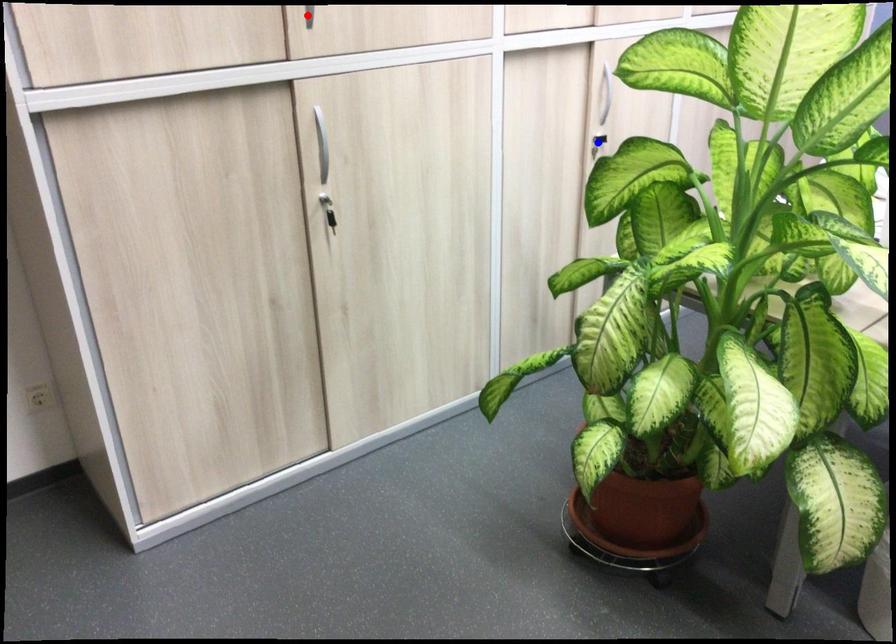
Question: In the image, two points are highlighted. Which point is nearer to the camera? Reply with the corresponding letter.

Choices:
 (A) blue point
 (B) red point

Answer: (B)